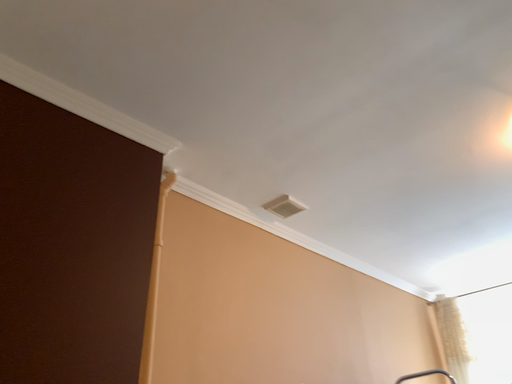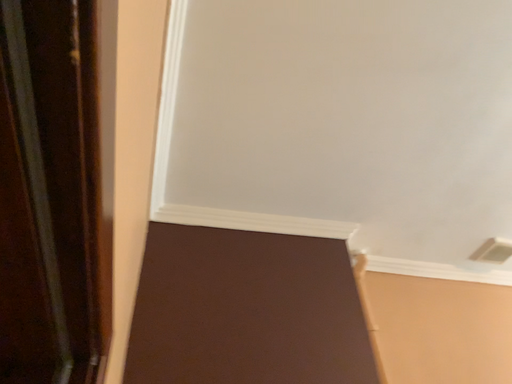
Question: Which way did the camera rotate in the video?

Choices:
 (A) rotated upward
 (B) rotated downward

Answer: (A)